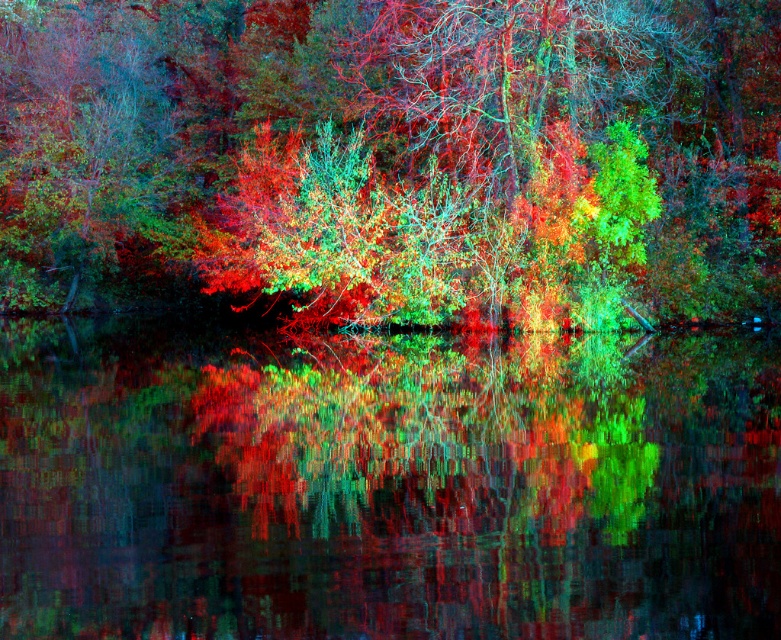
Can you confirm if multicolored foliage at center is wider than reflective glass water at center?

Correct, the width of multicolored foliage at center exceeds that of reflective glass water at center.

Is point (405, 292) closer to camera compared to point (496, 576)?

No, it is not.

Describe the element at coordinates (394, 156) in the screenshot. I see `multicolored foliage at center` at that location.

The image size is (781, 640). I want to click on multicolored foliage at center, so click(394, 156).